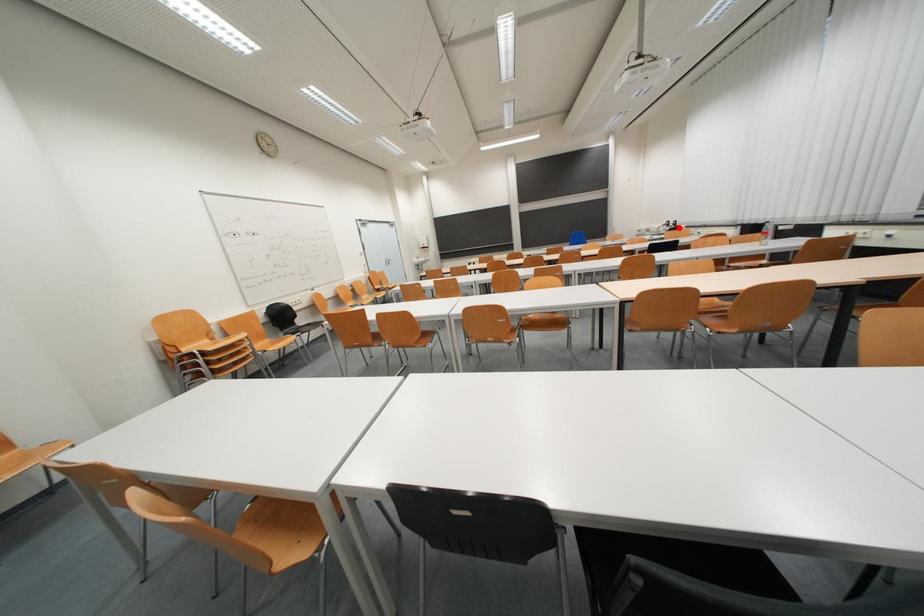
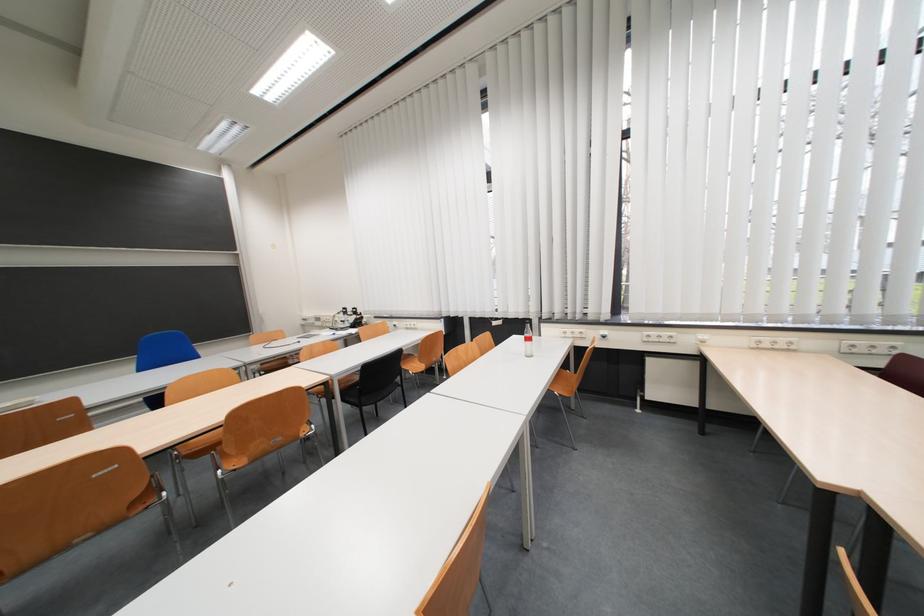
Question: I am providing you with two images of the same scene from different viewpoints. A red point is shown in image1. For the corresponding object point in image2, is it positioned nearer or farther from the camera?

Choices:
 (A) Nearer
 (B) Farther

Answer: (B)